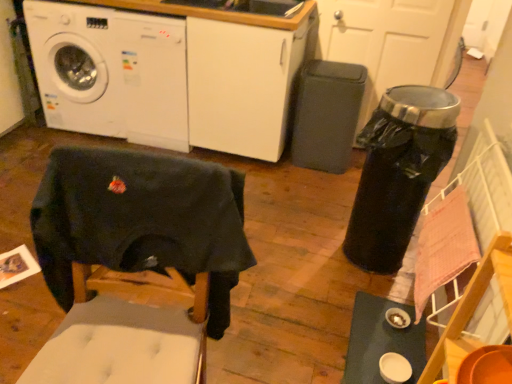
Question: Is point (104, 29) closer or farther from the camera than point (140, 72)?

Choices:
 (A) farther
 (B) closer

Answer: (B)

Question: Is white glossy washing machine at upper left, the 1th washing machine when ordered from left to right, taller or shorter than white glossy washing machine at upper left, the second washing machine in the left-to-right sequence?

Choices:
 (A) tall
 (B) short

Answer: (B)

Question: Which object is positioned farthest from the white glossy washing machine at upper left, the 1th washing machine when ordered from left to right?

Choices:
 (A) dark fabric swivel chair at lower left
 (B) white glossy washing machine at upper left, marked as the first washing machine in a right-to-left arrangement
 (C) white glossy table at lower right

Answer: (C)

Question: Estimate the real-world distances between objects in this image. Which object is farther from the dark fabric swivel chair at lower left?

Choices:
 (A) white glossy washing machine at upper left, the second washing machine in the left-to-right sequence
 (B) white glossy table at lower right
 (C) white glossy washing machine at upper left, which is the 2th washing machine in right-to-left order

Answer: (C)